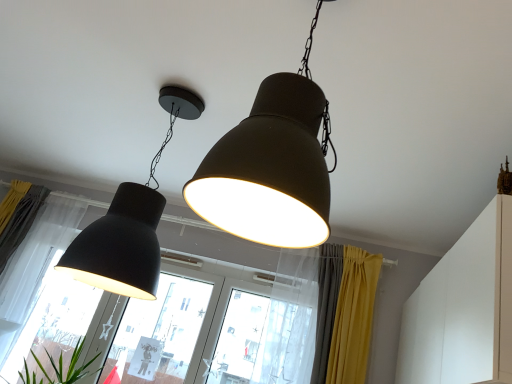
Question: Considering the positions of white sheer curtain at left, arranged as the 3th curtain when viewed from the right, and transparent glass window at center, arranged as the 3th window when viewed from the left, in the image, is white sheer curtain at left, arranged as the 3th curtain when viewed from the right, bigger or smaller than transparent glass window at center, arranged as the 3th window when viewed from the left,?

Choices:
 (A) big
 (B) small

Answer: (A)

Question: Is white sheer curtain at left, arranged as the 3th curtain when viewed from the right, wider or thinner than transparent glass window at center, arranged as the 3th window when viewed from the left?

Choices:
 (A) wide
 (B) thin

Answer: (A)

Question: Considering the real-world distances, which object is closest to the silky yellow curtain at center, acting as the 2th curtain starting from the right?

Choices:
 (A) white sheer curtain at left, arranged as the 3th curtain when viewed from the right
 (B) yellow fabric curtain at lower right, arranged as the third curtain when viewed from the left
 (C) transparent glass window at center, acting as the second window starting from the left
 (D) matte black lampshade at left, which ranks as the first lamp in back-to-front order
 (E) white matte cabinet at upper right

Answer: (B)

Question: Estimate the real-world distances between objects in this image. Which object is closer to the white sheer curtain at left, which is the first curtain in left-to-right order?

Choices:
 (A) silky yellow curtain at center, the second curtain in the left-to-right sequence
 (B) white matte cabinet at upper right
 (C) yellow fabric curtain at lower right, arranged as the third curtain when viewed from the left
 (D) transparent glass window at center, the first window from the right
 (E) matte black lampshade at left, the 1th lamp from the left

Answer: (E)